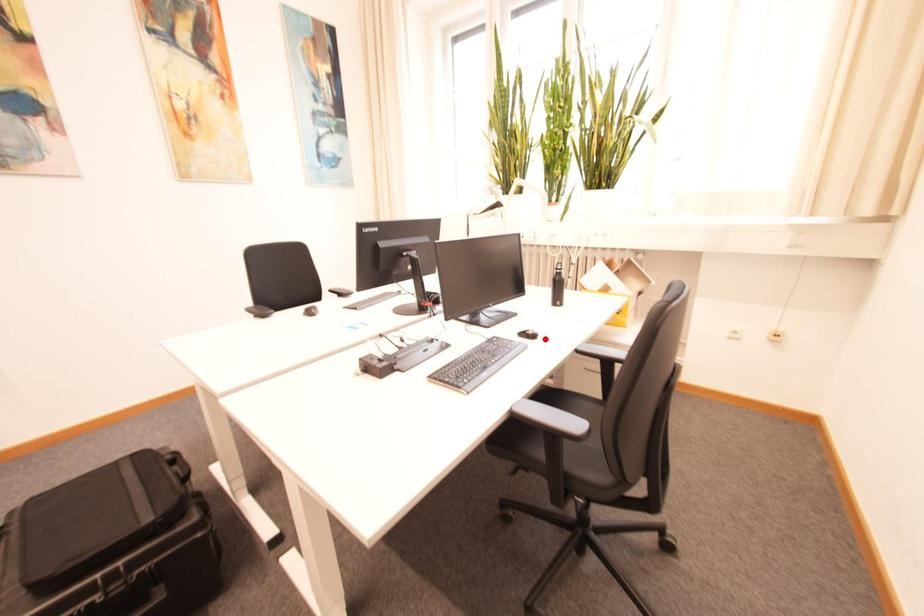
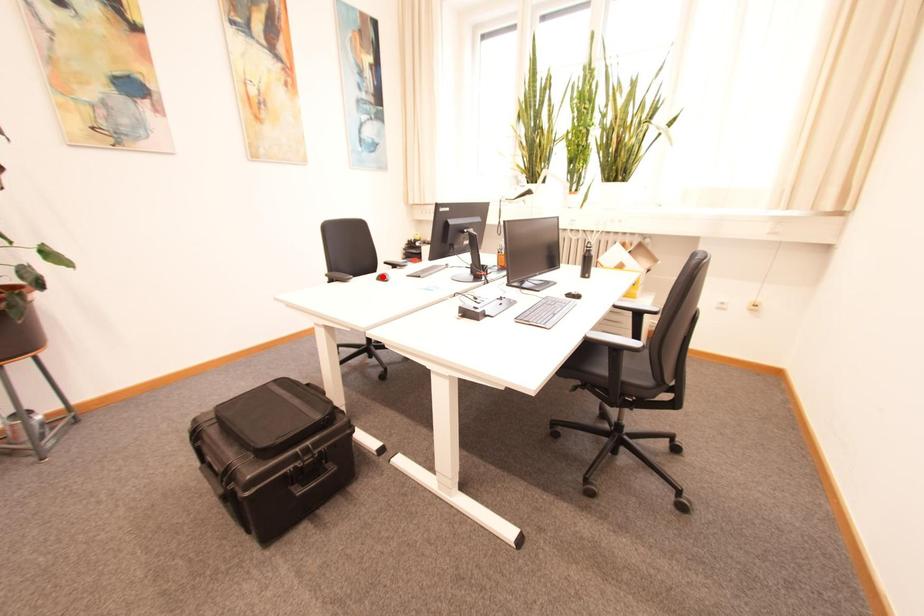
I am providing you with two images of the same scene from different viewpoints. A red point is marked on the first image and another point is marked on the second image. Is the red point in image1 aligned with the point shown in image2?

No